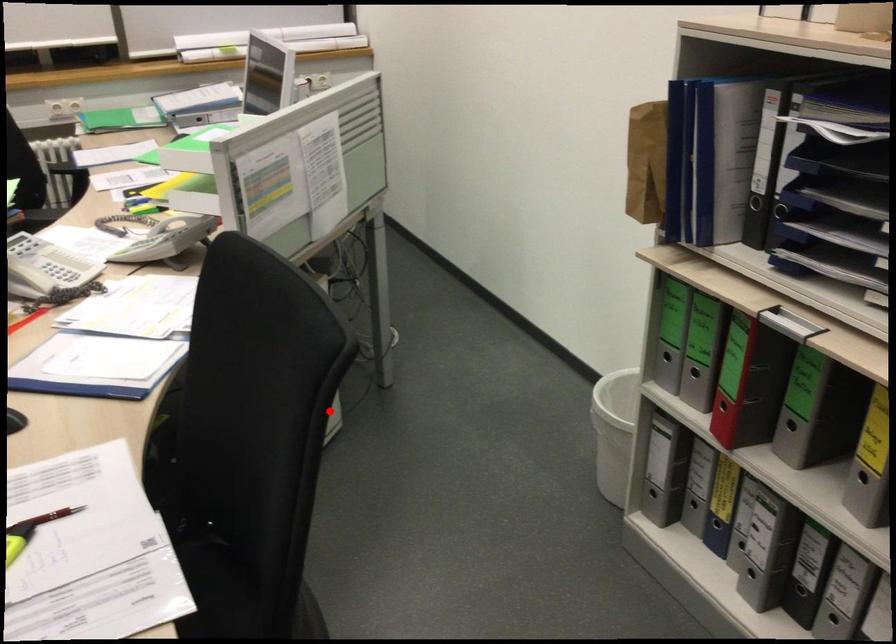
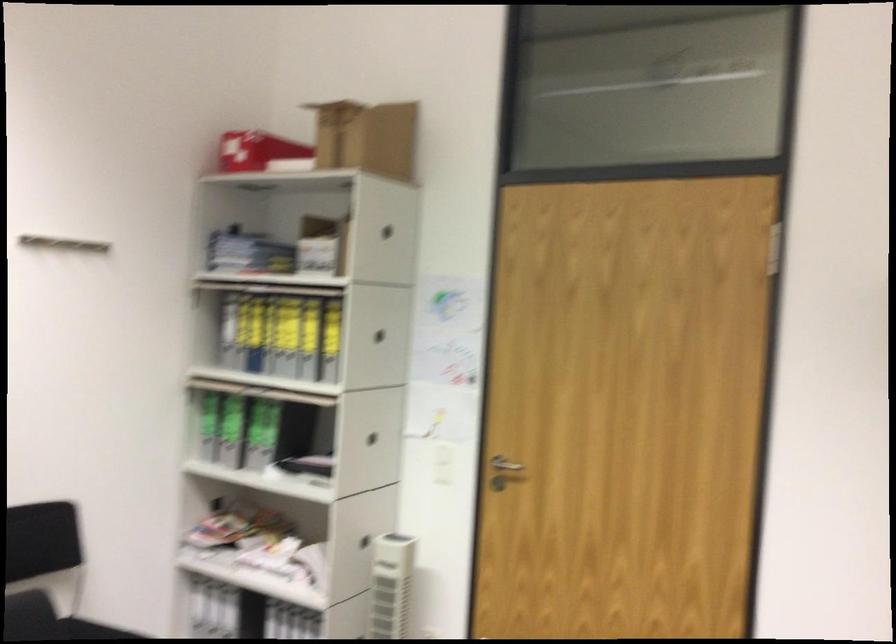
Question: A red point is marked in image1. In image2, is the corresponding 3D point closer to the camera or farther? Reply with the corresponding letter.

Choices:
 (A) The corresponding 3D point is closer.
 (B) The corresponding 3D point is farther.

Answer: (B)